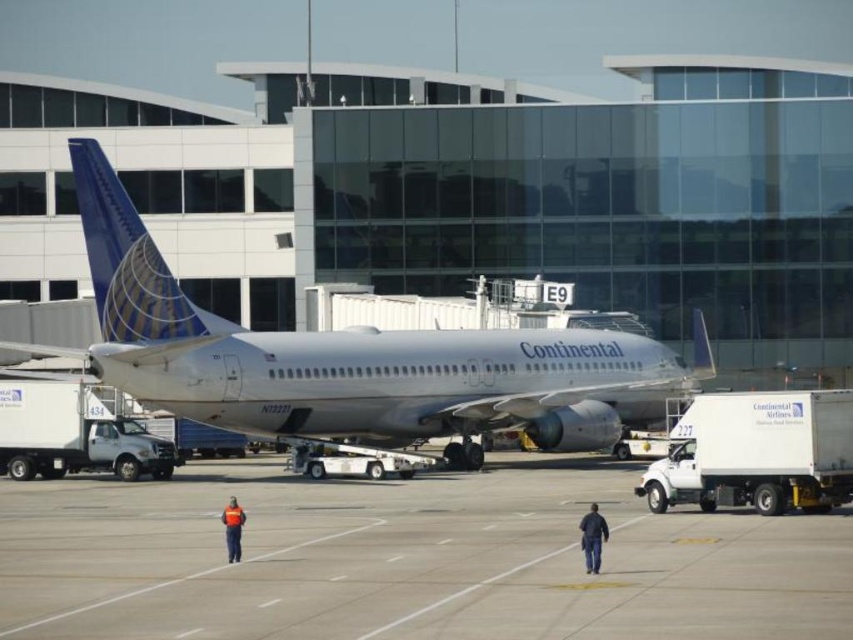
You are a passenger standing at the gate E9 and looking towards the Continental Airlines aircraft. You see the gray concrete tarmac at center and the orange reflective vest at center. Which object is closer to you?

The gray concrete tarmac at center is closer to you because it is in front of the orange reflective vest at center.